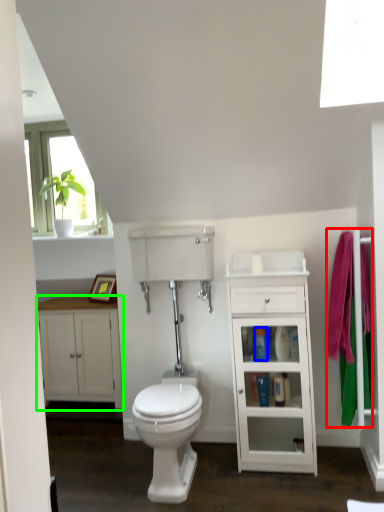
Question: Estimate the real-world distances between objects in this image. Which object is closer to bath towel (highlighted by a red box), toiletry (highlighted by a blue box) or bathroom cabinet (highlighted by a green box)?

Choices:
 (A) toiletry
 (B) bathroom cabinet

Answer: (A)